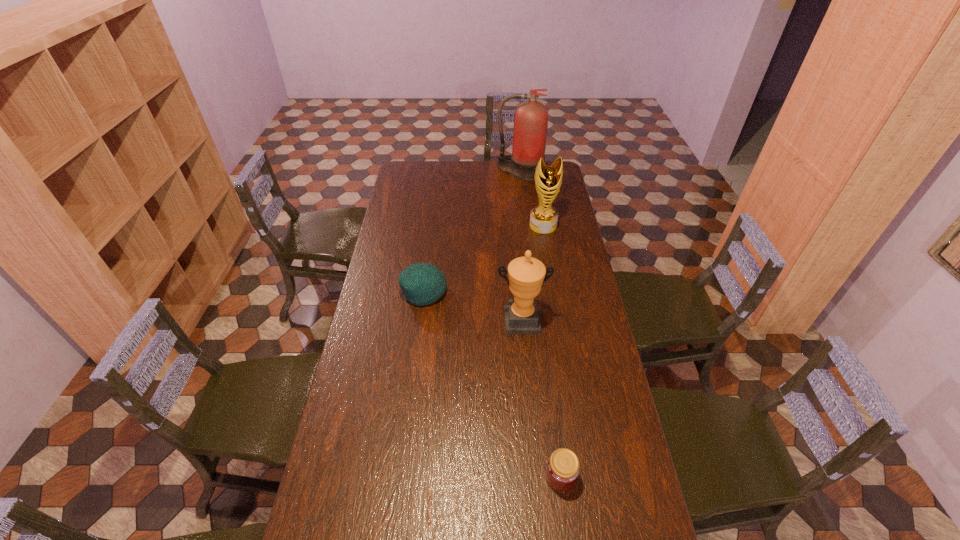
Locate an element on the screen. vacant space at the far left corner of the desktop is located at coordinates (409, 163).

The image size is (960, 540). Identify the location of vacant region between the farthest object and the nearer award. (520, 246).

Locate an element on the screen. Image resolution: width=960 pixels, height=540 pixels. vacant space in between the farther award and the fourth tallest object is located at coordinates point(484,259).

Identify the location of vacant area between the fire extinguisher and the farther award. (532, 199).

At what (x,y) coordinates should I click in order to perform the action: click on vacant area that lies between the jam and the beanie. Please return your answer as a coordinate pair (x, y). Looking at the image, I should click on (492, 384).

Find the location of a particular element. free space that is in between the tallest object and the leftmost object is located at coordinates (472, 232).

Image resolution: width=960 pixels, height=540 pixels. I want to click on free space between the leftmost object and the farther award, so click(x=484, y=259).

Where is `free space between the beanie and the farthest object`? free space between the beanie and the farthest object is located at coordinates (472, 232).

Where is `vacant area that lies between the leftmost object and the nearer award`? vacant area that lies between the leftmost object and the nearer award is located at coordinates (472, 306).

I want to click on object that is the second closest to the fire extinguisher, so click(422, 283).